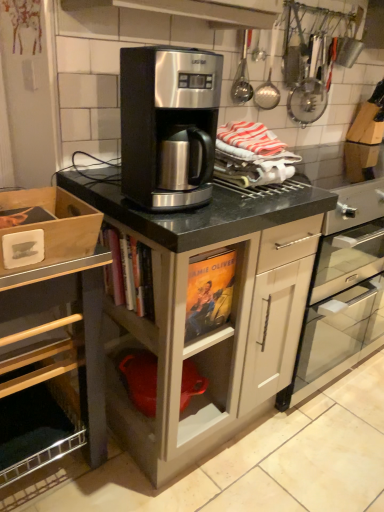
Question: Considering the relative positions of stainless steel coffee maker at center and matte black coffee maker at center, which is the second cabinetry from left to right, in the image provided, is stainless steel coffee maker at center to the right of matte black coffee maker at center, which is the second cabinetry from left to right, from the viewer's perspective?

Choices:
 (A) no
 (B) yes

Answer: (A)

Question: Does stainless steel coffee maker at center lie behind matte black coffee maker at center, which is the second cabinetry from left to right?

Choices:
 (A) yes
 (B) no

Answer: (B)

Question: From the image's perspective, is stainless steel coffee maker at center located above matte black coffee maker at center, which is the second cabinetry from left to right?

Choices:
 (A) yes
 (B) no

Answer: (A)

Question: Is stainless steel coffee maker at center to the left of matte black coffee maker at center, marked as the 1th cabinetry in a right-to-left arrangement, from the viewer's perspective?

Choices:
 (A) no
 (B) yes

Answer: (B)

Question: Is stainless steel coffee maker at center oriented away from matte black coffee maker at center, which is the second cabinetry from left to right?

Choices:
 (A) yes
 (B) no

Answer: (B)

Question: In terms of height, does wooden box at left, marked as the second cabinetry in a right-to-left arrangement, look taller or shorter compared to satin black coffee maker at center?

Choices:
 (A) tall
 (B) short

Answer: (A)

Question: Is wooden box at left, placed as the 1th cabinetry when sorted from left to right, inside or outside of satin black coffee maker at center?

Choices:
 (A) inside
 (B) outside

Answer: (B)

Question: Considering their positions, is wooden box at left, marked as the second cabinetry in a right-to-left arrangement, located in front of or behind satin black coffee maker at center?

Choices:
 (A) front
 (B) behind

Answer: (A)

Question: In the image, is wooden box at left, marked as the second cabinetry in a right-to-left arrangement, on the left side or the right side of satin black coffee maker at center?

Choices:
 (A) left
 (B) right

Answer: (A)

Question: Is satin black coffee maker at center wider or thinner than wooden box at left, placed as the 1th cabinetry when sorted from left to right?

Choices:
 (A) thin
 (B) wide

Answer: (A)

Question: Looking at the image, does satin black coffee maker at center seem bigger or smaller compared to wooden box at left, marked as the second cabinetry in a right-to-left arrangement?

Choices:
 (A) small
 (B) big

Answer: (B)

Question: Does point (307, 331) appear closer or farther from the camera than point (6, 315)?

Choices:
 (A) closer
 (B) farther

Answer: (B)

Question: From a real-world perspective, is satin black coffee maker at center physically located above or below wooden box at left, marked as the second cabinetry in a right-to-left arrangement?

Choices:
 (A) above
 (B) below

Answer: (A)

Question: From their relative heights in the image, would you say satin black coffee maker at center is taller or shorter than matte black coffee maker at center, marked as the 1th cabinetry in a right-to-left arrangement?

Choices:
 (A) tall
 (B) short

Answer: (B)

Question: From a real-world perspective, is satin black coffee maker at center positioned above or below matte black coffee maker at center, which is the second cabinetry from left to right?

Choices:
 (A) below
 (B) above

Answer: (A)